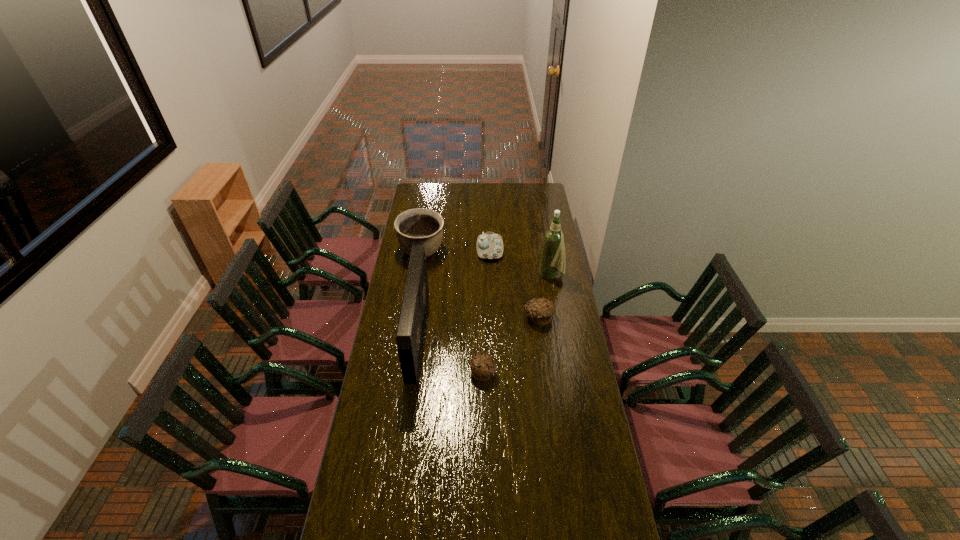
Given the evenly spaced muffins in the image, where should an extra muffin be added on the left to preserve the spacing? Please point to a vacant space. Please provide its 2D coordinates. Your answer should be formatted as a tuple, i.e. [(x, y)], where the tuple contains the x and y coordinates of a point satisfying the conditions above.

[(411, 443)]